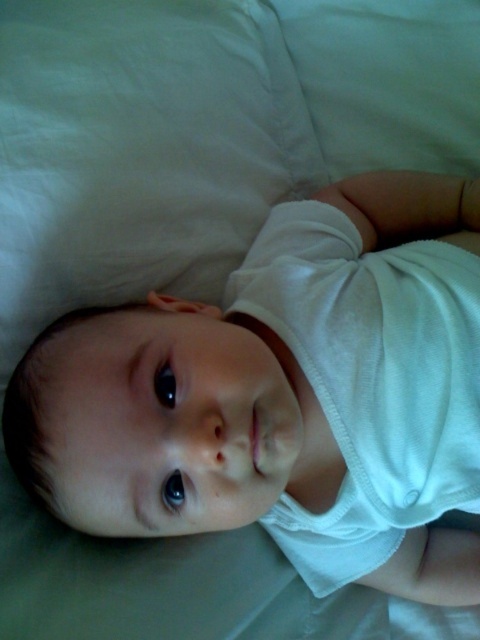
In the scene shown: You are a photographer setting up a studio for a newborn photoshoot. You have a white fabric baby at center and a white soft cloth diaper at center. Which object should you place first to ensure proper positioning, considering their sizes?

The white fabric baby at center is larger in size than the white soft cloth diaper at center, so you should place the white fabric baby at center first to ensure proper positioning.

Looking at the baby lying on its back in the center of the image, which object is wider between the white fabric baby at center and the white soft cloth diaper at center?

The white fabric baby at center is wider than the white soft cloth diaper at center.

You are a nurse in a hospital nursery. You need to check if the distance between the white fabric baby at center and the white soft cloth diaper at center is sufficient to prevent the diaper from touching the baby. The hospital guideline states that there must be at least 2 inches between them for hygiene reasons. Is the current distance compliant with the guidelines?

The white fabric baby at center and white soft cloth diaper at center are 1.55 inches apart from each other. Since the required distance is 2 inches, the current distance is insufficient and does not comply with the hospital guidelines.